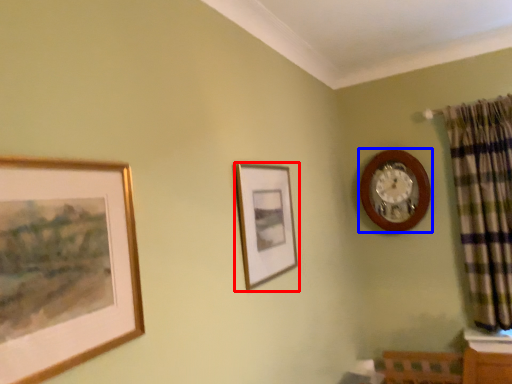
Question: Which object is closer to the camera taking this photo, picture frame (highlighted by a red box) or wall clock (highlighted by a blue box)?

Choices:
 (A) picture frame
 (B) wall clock

Answer: (A)